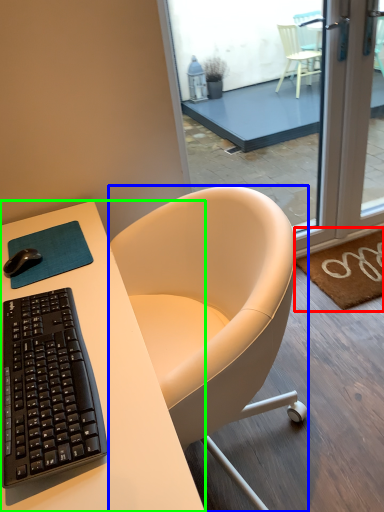
Question: Based on their relative distances, which object is farther from doormat (highlighted by a red box)? Choose from chair (highlighted by a blue box) and desk (highlighted by a green box).

Choices:
 (A) chair
 (B) desk

Answer: (B)